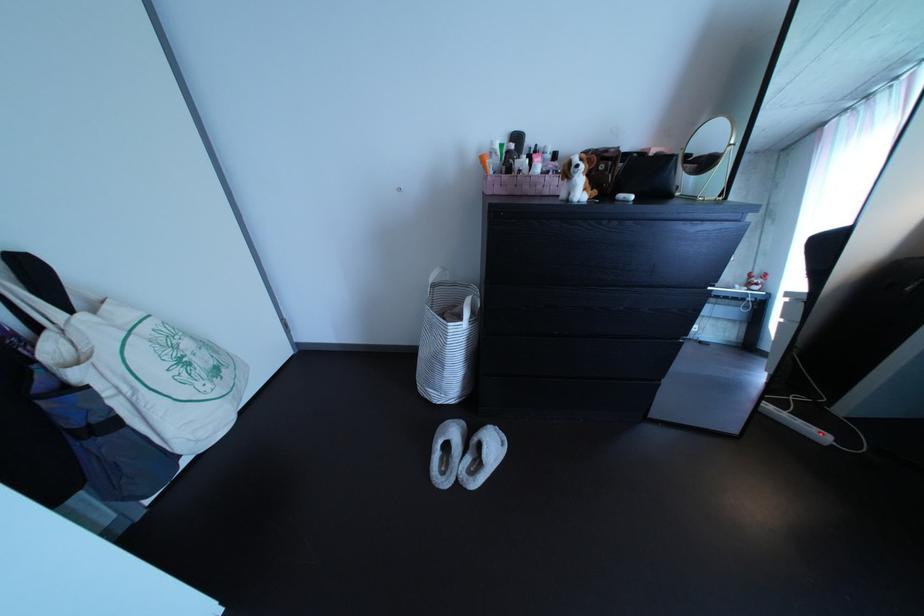
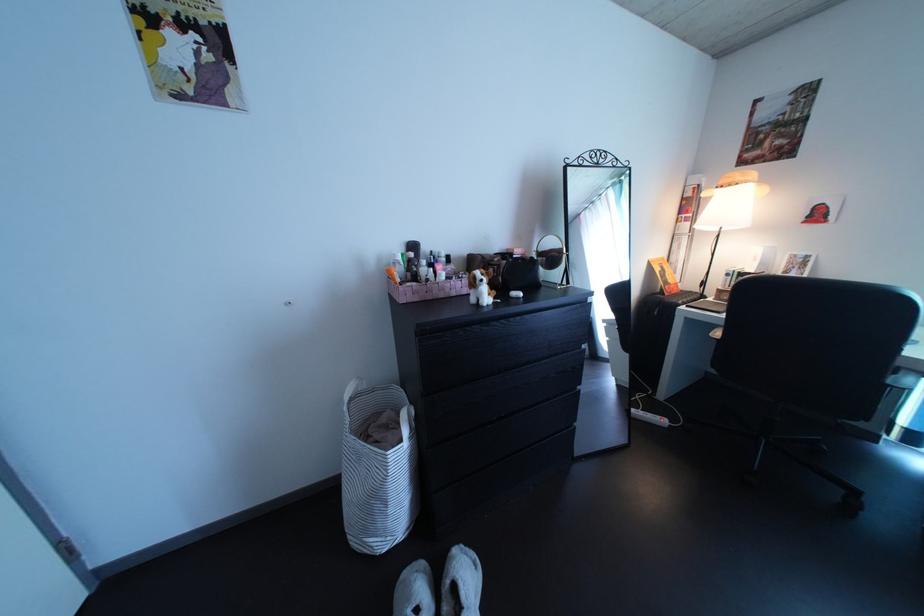
The point at (832, 438) is marked in the first image. Where is the corresponding point in the second image?

(673, 424)